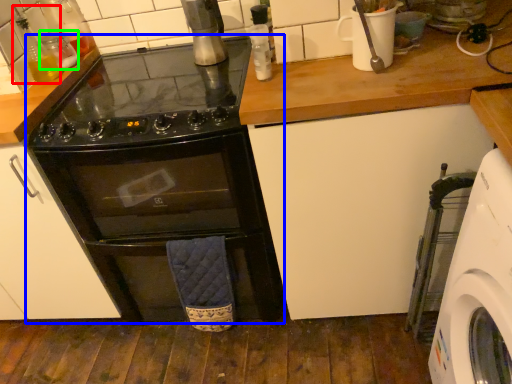
Question: Considering the real-world distances, which object is closest to bottle (highlighted by a red box)? oven (highlighted by a blue box) or bottle (highlighted by a green box).

Choices:
 (A) oven
 (B) bottle

Answer: (B)